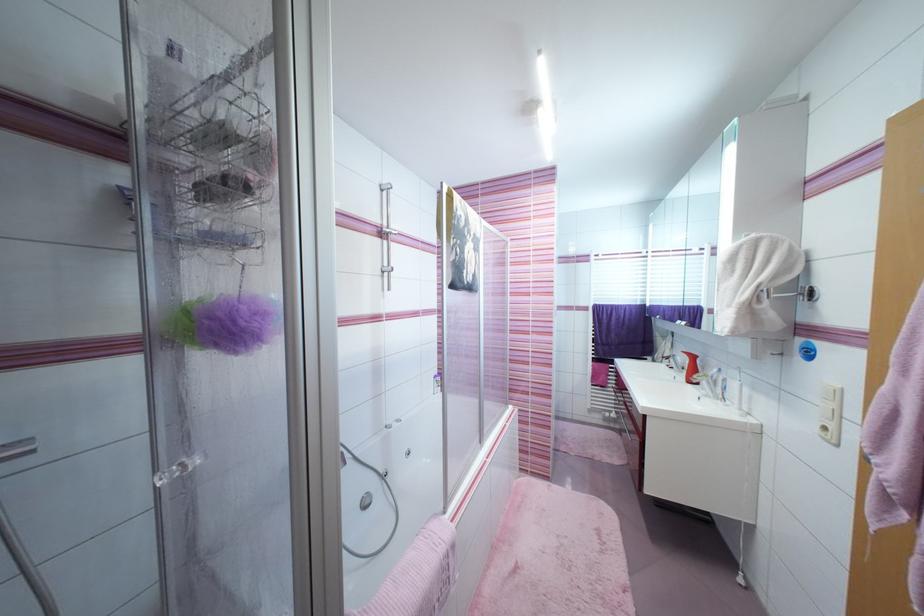
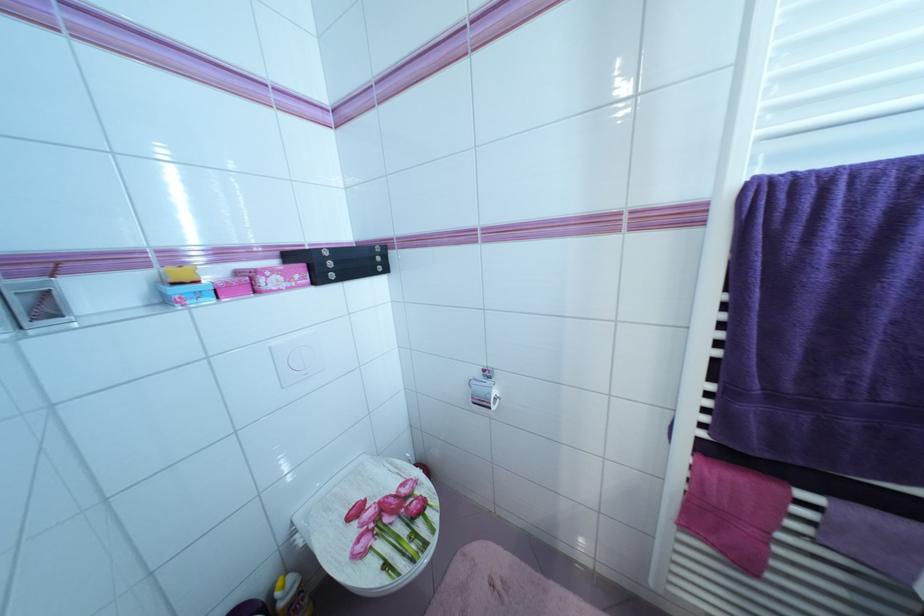
Which direction would the cameraman need to move to produce the second image?

The cameraman moved toward right, forward.